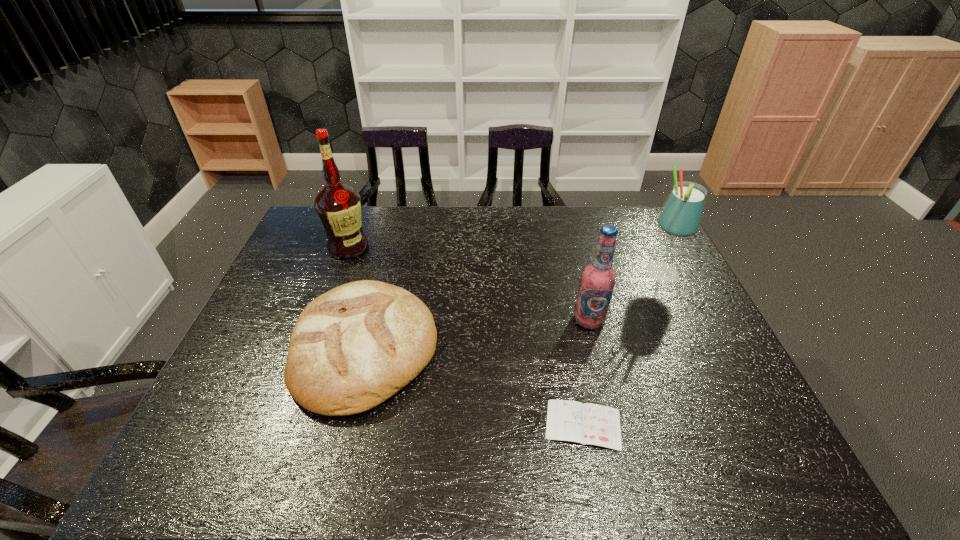
Locate an element on the screen. This screenshot has width=960, height=540. vacant space that satisfies the following two spatial constraints: 1. on the back side of the diary; 2. on the right side of the rightmost alcohol is located at coordinates (554, 274).

At what (x,y) coordinates should I click in order to perform the action: click on free space that satisfies the following two spatial constraints: 1. on the back side of the shortest alcohol; 2. on the left side of the second shortest object. Please return your answer as a coordinate pair (x, y). Looking at the image, I should click on (372, 320).

You are a GUI agent. You are given a task and a screenshot of the screen. Output one action in this format:
    pyautogui.click(x=<x>, y=<y>)
    Task: Click on the free point that satisfies the following two spatial constraints: 1. on the label of the rightmost alcohol; 2. on the right side of the leftmost alcohol
    The height and width of the screenshot is (540, 960).
    Given the screenshot: What is the action you would take?
    pyautogui.click(x=339, y=274)

I want to click on free space that satisfies the following two spatial constraints: 1. on the label of the leftmost alcohol; 2. on the left side of the nearest alcohol, so pyautogui.click(x=322, y=320).